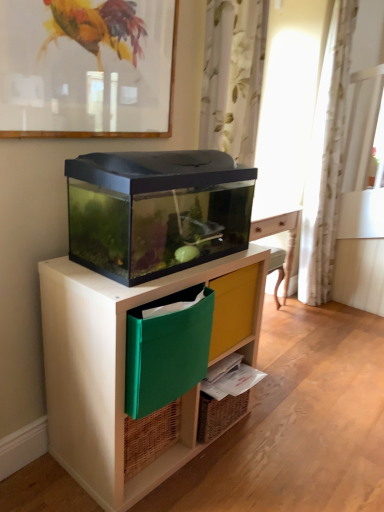
Find the location of a particular element. vacant area to the right of matte black aquarium at center is located at coordinates (293, 441).